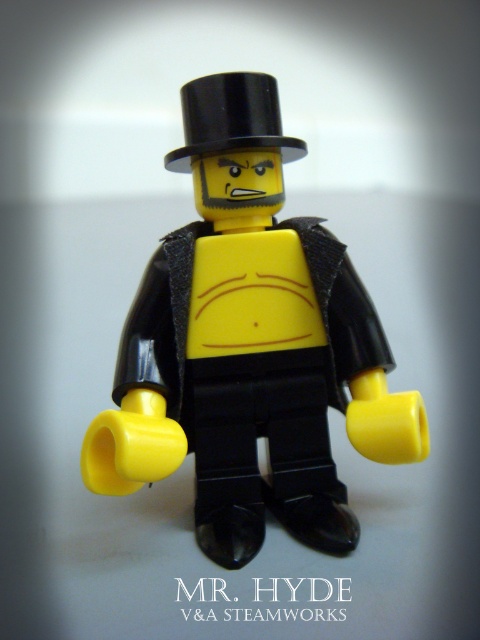
Question: Which object is closer to the camera taking this photo?

Choices:
 (A) matte black minifigure at center
 (B) black glossy top hat at upper center

Answer: (A)

Question: Which point is closer to the camera?

Choices:
 (A) black glossy top hat at upper center
 (B) matte black minifigure at center

Answer: (B)

Question: Does matte black minifigure at center come behind black glossy top hat at upper center?

Choices:
 (A) no
 (B) yes

Answer: (A)

Question: Considering the relative positions of matte black minifigure at center and black glossy top hat at upper center in the image provided, where is matte black minifigure at center located with respect to black glossy top hat at upper center?

Choices:
 (A) below
 (B) above

Answer: (A)

Question: Which object is closer to the camera taking this photo?

Choices:
 (A) matte black minifigure at center
 (B) black glossy top hat at upper center

Answer: (A)

Question: Does matte black minifigure at center have a larger size compared to black glossy top hat at upper center?

Choices:
 (A) no
 (B) yes

Answer: (B)